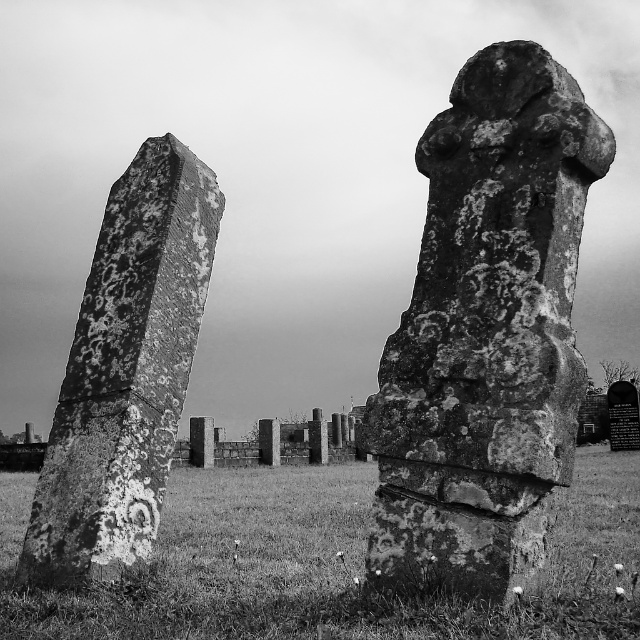
Between rusty stone monument at center and rusty stone gravestone at left, which one appears on the right side from the viewer's perspective?

From the viewer's perspective, rusty stone monument at center appears more on the right side.

The image size is (640, 640). Find the location of `rusty stone monument at center`. rusty stone monument at center is located at coordinates (323, 564).

Can you confirm if rough stone cross at center is wider than rusty stone gravestone at left?

Indeed, rough stone cross at center has a greater width compared to rusty stone gravestone at left.

Between point (410, 428) and point (65, 419), which one is positioned in front?

Positioned in front is point (410, 428).

What are the coordinates of `rough stone cross at center` in the screenshot? It's located at (486, 332).

Does rough stone cross at center appear on the left side of rusty stone monument at center?

Indeed, rough stone cross at center is positioned on the left side of rusty stone monument at center.

Does point (465, 243) lie behind point (236, 612)?

No, it is in front of (236, 612).

What are the coordinates of `rough stone cross at center` in the screenshot? It's located at (486, 332).